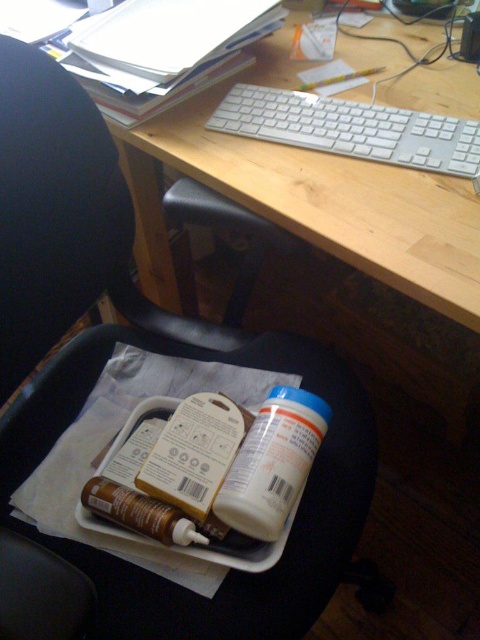
Is black plastic swivel chair at lower center shorter than wooden at upper center?

No, black plastic swivel chair at lower center is not shorter than wooden at upper center.

What do you see at coordinates (232, 573) in the screenshot? I see `black plastic swivel chair at lower center` at bounding box center [232, 573].

This screenshot has height=640, width=480. I want to click on black plastic swivel chair at lower center, so click(x=232, y=573).

Which is behind, point (127, 579) or point (477, 132)?

The point (477, 132) is behind.

Is black plastic swivel chair at lower center taller than white plastic keyboard at upper center?

Yes, black plastic swivel chair at lower center is taller than white plastic keyboard at upper center.

This screenshot has height=640, width=480. I want to click on black plastic swivel chair at lower center, so click(232, 573).

Can you confirm if wooden at upper center is positioned to the right of white matte bottle at lower center?

Incorrect, wooden at upper center is not on the right side of white matte bottle at lower center.

Between point (326, 156) and point (279, 440), which one is positioned in front?

Positioned in front is point (279, 440).

Which is in front, point (391, 81) or point (292, 474)?

Positioned in front is point (292, 474).

Image resolution: width=480 pixels, height=640 pixels. I want to click on wooden at upper center, so click(307, 198).